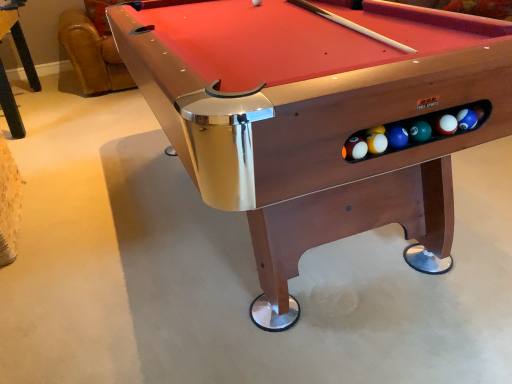
At what (x,y) coordinates should I click in order to perform the action: click on wooden billiard table at center. Please return your answer as a coordinate pair (x, y). Looking at the image, I should click on (319, 117).

What do you see at coordinates (319, 117) in the screenshot? Image resolution: width=512 pixels, height=384 pixels. I see `wooden billiard table at center` at bounding box center [319, 117].

Find the location of `wooden pool table at lower left`. wooden pool table at lower left is located at coordinates 18,39.

What do you see at coordinates (18, 39) in the screenshot? I see `wooden pool table at lower left` at bounding box center [18, 39].

I want to click on wooden billiard table at center, so click(319, 117).

Considering the positions of objects wooden pool table at lower left and wooden billiard table at center in the image provided, who is more to the left, wooden pool table at lower left or wooden billiard table at center?

From the viewer's perspective, wooden pool table at lower left appears more on the left side.

Who is more distant, wooden pool table at lower left or wooden billiard table at center?

wooden pool table at lower left is more distant.

Is point (9, 122) farther from viewer compared to point (268, 173)?

Yes, it is.

From the image's perspective, between wooden pool table at lower left and wooden billiard table at center, which one is located above?

From the image's view, wooden pool table at lower left is above.

From a real-world perspective, is wooden pool table at lower left over wooden billiard table at center?

Correct, in the physical world, wooden pool table at lower left is higher than wooden billiard table at center.

Can you confirm if wooden pool table at lower left is wider than wooden billiard table at center?

In fact, wooden pool table at lower left might be narrower than wooden billiard table at center.

In the scene shown: Does wooden pool table at lower left have a lesser height compared to wooden billiard table at center?

No, wooden pool table at lower left is not shorter than wooden billiard table at center.

Considering the relative sizes of wooden pool table at lower left and wooden billiard table at center in the image provided, is wooden pool table at lower left bigger than wooden billiard table at center?

Incorrect, wooden pool table at lower left is not larger than wooden billiard table at center.

Is wooden pool table at lower left not within wooden billiard table at center?

Absolutely, wooden pool table at lower left is external to wooden billiard table at center.

Would you say wooden pool table at lower left is a long distance from wooden billiard table at center?

Yes, wooden pool table at lower left is far from wooden billiard table at center.

Is wooden pool table at lower left aimed at wooden billiard table at center?

No, wooden pool table at lower left is not oriented towards wooden billiard table at center.

This screenshot has width=512, height=384. I want to click on billiard table that appears in front of the wooden pool table at lower left, so click(x=319, y=117).

Which object is positioned more to the right, wooden billiard table at center or wooden pool table at lower left?

Positioned to the right is wooden billiard table at center.

Relative to wooden pool table at lower left, is wooden billiard table at center in front or behind?

Visually, wooden billiard table at center is located in front of wooden pool table at lower left.

Considering the points (211, 184) and (29, 58), which point is behind, point (211, 184) or point (29, 58)?

The point (29, 58) is farther from the camera.

From the image's perspective, relative to wooden pool table at lower left, is wooden billiard table at center above or below?

From the image's perspective, wooden billiard table at center appears below wooden pool table at lower left.

From a real-world perspective, is wooden billiard table at center on top of wooden pool table at lower left?

A: Incorrect, from a real-world perspective, wooden billiard table at center is lower than wooden pool table at lower left.

Consider the image. In terms of width, does wooden billiard table at center look wider or thinner when compared to wooden pool table at lower left?

In the image, wooden billiard table at center appears to be wider than wooden pool table at lower left.

Can you confirm if wooden billiard table at center is taller than wooden pool table at lower left?

In fact, wooden billiard table at center may be shorter than wooden pool table at lower left.

In terms of size, does wooden billiard table at center appear bigger or smaller than wooden pool table at lower left?

wooden billiard table at center is bigger than wooden pool table at lower left.

Is wooden billiard table at center not within wooden pool table at lower left?

Yes, wooden billiard table at center is not within wooden pool table at lower left.

Can you see wooden billiard table at center touching wooden pool table at lower left?

There is a gap between wooden billiard table at center and wooden pool table at lower left.

Is wooden billiard table at center turned away from wooden pool table at lower left?

No.

How many degrees apart are the facing directions of wooden billiard table at center and wooden pool table at lower left?

The facing directions of wooden billiard table at center and wooden pool table at lower left are 2.32 degrees apart.

Find the location of a particular element. Image resolution: width=512 pixels, height=384 pixels. billiard table located below the wooden pool table at lower left (from the image's perspective) is located at coordinates [x=319, y=117].

In the image, there is a wooden pool table at lower left. At what (x,y) coordinates should I click in order to perform the action: click on billiard table below it (from the image's perspective). Please return your answer as a coordinate pair (x, y). The image size is (512, 384). Looking at the image, I should click on (319, 117).

Locate an element on the screen. Image resolution: width=512 pixels, height=384 pixels. table that is above the wooden billiard table at center (from a real-world perspective) is located at coordinates (18, 39).